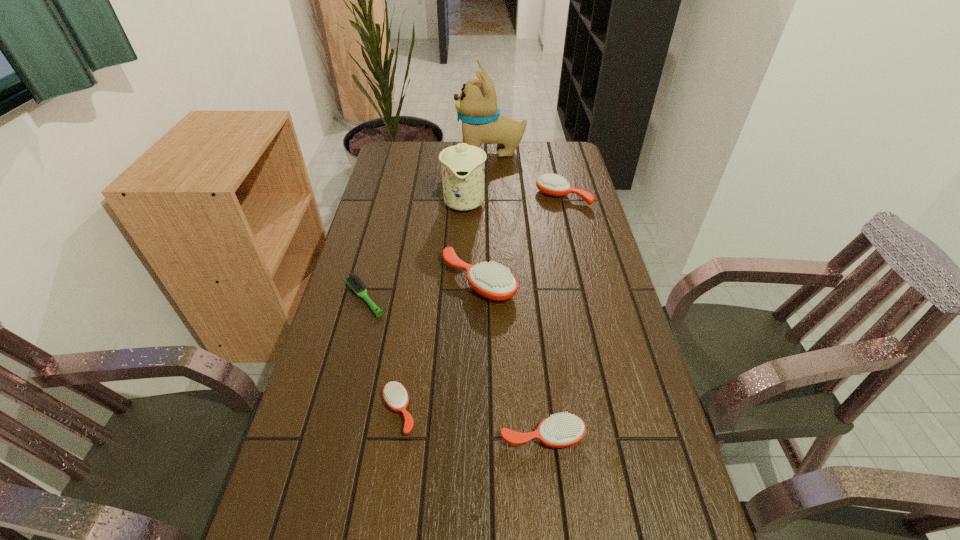
Locate an element on the screen. This screenshot has width=960, height=540. free space between the second tallest object and the leftmost hairbrush is located at coordinates (414, 249).

Where is `unoccupied area between the farthest hairbrush and the leftmost orange hairbrush`? Image resolution: width=960 pixels, height=540 pixels. unoccupied area between the farthest hairbrush and the leftmost orange hairbrush is located at coordinates (481, 304).

Locate an element on the screen. The image size is (960, 540). empty space between the smallest orange hairbrush and the tallest object is located at coordinates (444, 281).

The image size is (960, 540). Identify the location of vacant area between the third smallest orange hairbrush and the second object from left to right. (481, 304).

Where is `vacant area between the farthest object and the tallest hairbrush`? vacant area between the farthest object and the tallest hairbrush is located at coordinates (485, 216).

Find the location of a particular element. The height and width of the screenshot is (540, 960). object that stands as the fourth closest to the chinaware is located at coordinates (353, 281).

Identify the location of object that is the fourth closest one to the farthest hairbrush. The height and width of the screenshot is (540, 960). (353, 281).

Identify which hairbrush is the third closest to the second hairbrush from left to right. Please provide its 2D coordinates. Your answer should be formatted as a tuple, i.e. [(x, y)], where the tuple contains the x and y coordinates of a point satisfying the conditions above.

[(493, 281)]

Choose which hairbrush is the nearest neighbor to the fifth shortest object. Please provide its 2D coordinates. Your answer should be formatted as a tuple, i.e. [(x, y)], where the tuple contains the x and y coordinates of a point satisfying the conditions above.

[(353, 281)]

Where is `orange hairbrush that can be found as the second closest to the shortest object`? The height and width of the screenshot is (540, 960). orange hairbrush that can be found as the second closest to the shortest object is located at coordinates (395, 395).